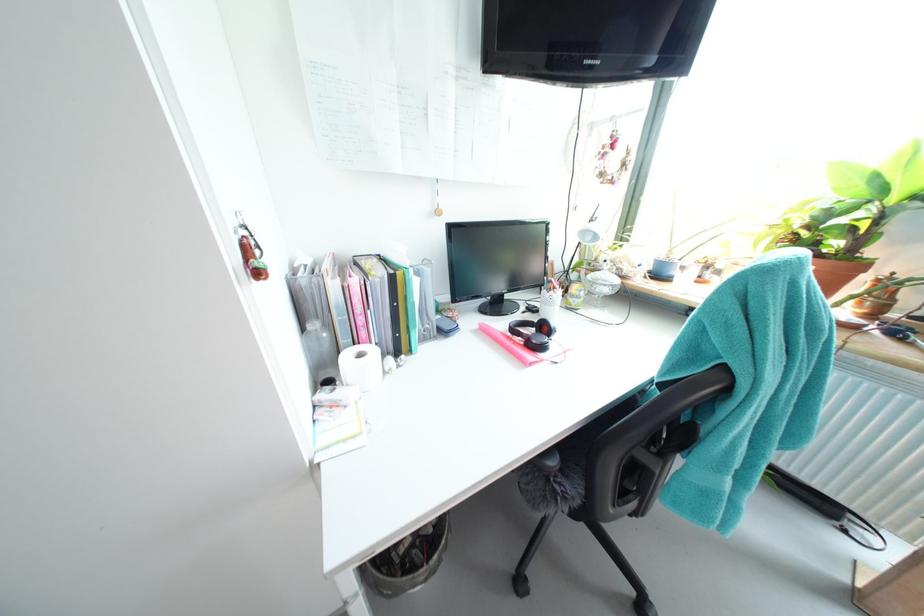
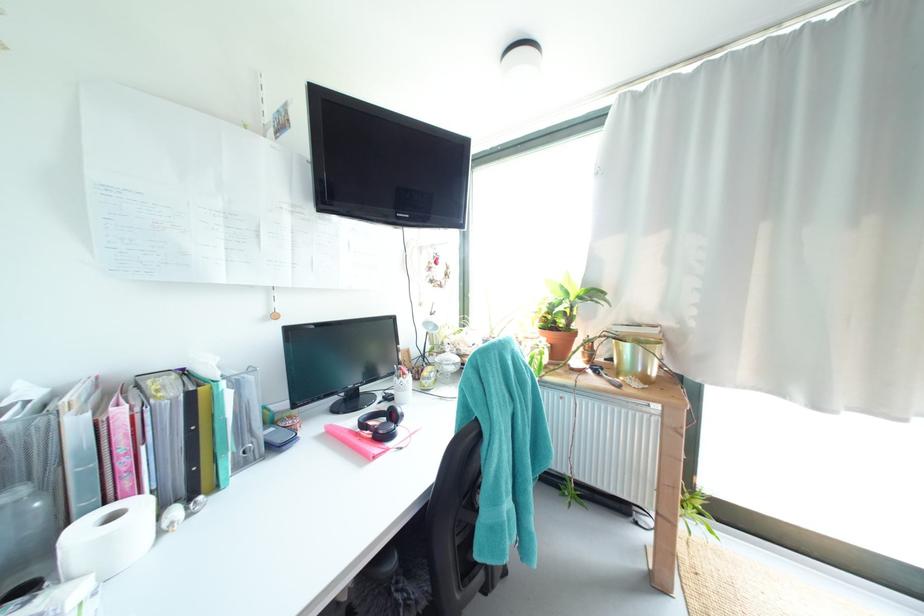
Locate, in the second image, the point that corresponds to pixel 435 272 in the first image.

(259, 379)